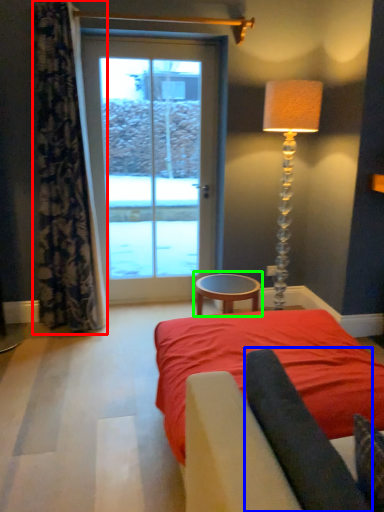
Question: Estimate the real-world distances between objects in this image. Which object is farther from curtain (highlighted by a red box), dark (highlighted by a blue box) or table (highlighted by a green box)?

Choices:
 (A) dark
 (B) table

Answer: (A)